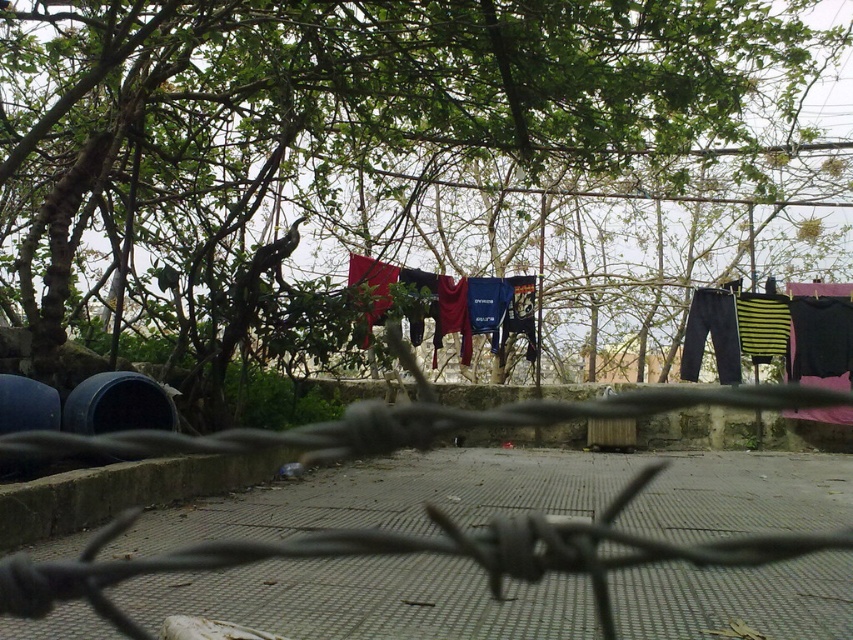
Consider the image. You are standing in the courtyard and want to take a photo of the red fabric clothes at center without the green leafy tree at upper center appearing in the frame. Is this possible given their positions?

The green leafy tree at upper center is closer to the viewer than the red fabric clothes at center. To avoid the tree in the photo, you would need to position yourself so that the tree is out of the camera frame while still capturing the clothes. Since the tree is closer, adjusting your angle or moving to a different vantage point might allow you to exclude the tree from the shot.

You are a photographer trying to capture the red fabric clothes at center without the barbed wire at center appearing in the shot. Is this possible given their positions?

The barbed wire at center is in front of the red fabric clothes at center, so it will block the view. You cannot capture the red fabric clothes at center without the barbed wire at center appearing in the shot.